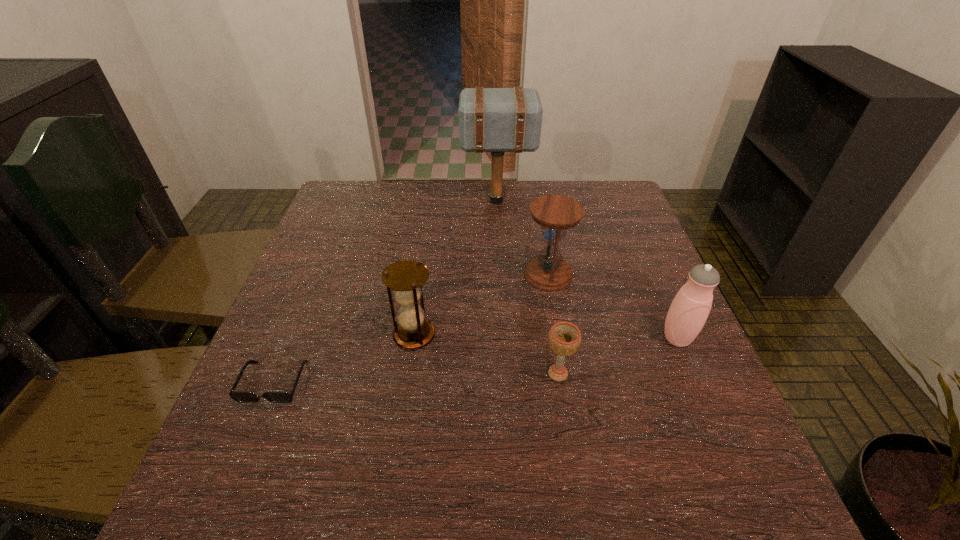
Where is `mallet`? This screenshot has height=540, width=960. mallet is located at coordinates (497, 120).

Locate an element on the screen. Image resolution: width=960 pixels, height=540 pixels. the tallest object is located at coordinates (497, 120).

This screenshot has width=960, height=540. I want to click on the rightmost object, so click(x=689, y=310).

Find the location of `the fifth nearest object`. the fifth nearest object is located at coordinates (555, 214).

This screenshot has height=540, width=960. Identify the location of the farther hourglass. (555, 214).

This screenshot has height=540, width=960. In order to click on the nearer hourglass in this screenshot , I will do `click(406, 277)`.

Find the location of `the fifth object from right to left`. the fifth object from right to left is located at coordinates (406, 277).

Where is `the fifth tallest object`? the fifth tallest object is located at coordinates (564, 337).

What are the coordinates of `the shortest object` in the screenshot? It's located at (239, 396).

You are a GUI agent. You are given a task and a screenshot of the screen. Output one action in this format:
    pyautogui.click(x=<x>, y=<y>)
    Task: Click on the sunglasses
    
    Given the screenshot: What is the action you would take?
    pyautogui.click(x=239, y=396)